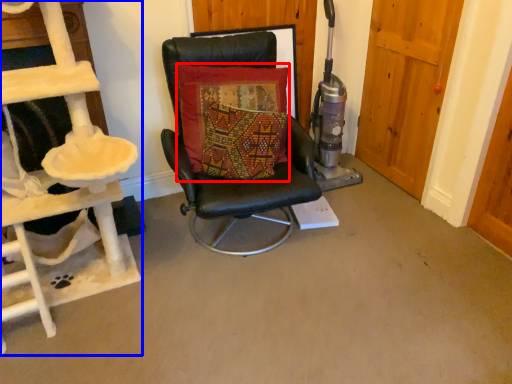
Question: Which object is further to the camera taking this photo, pillow (highlighted by a red box) or ladder (highlighted by a blue box)?

Choices:
 (A) pillow
 (B) ladder

Answer: (A)